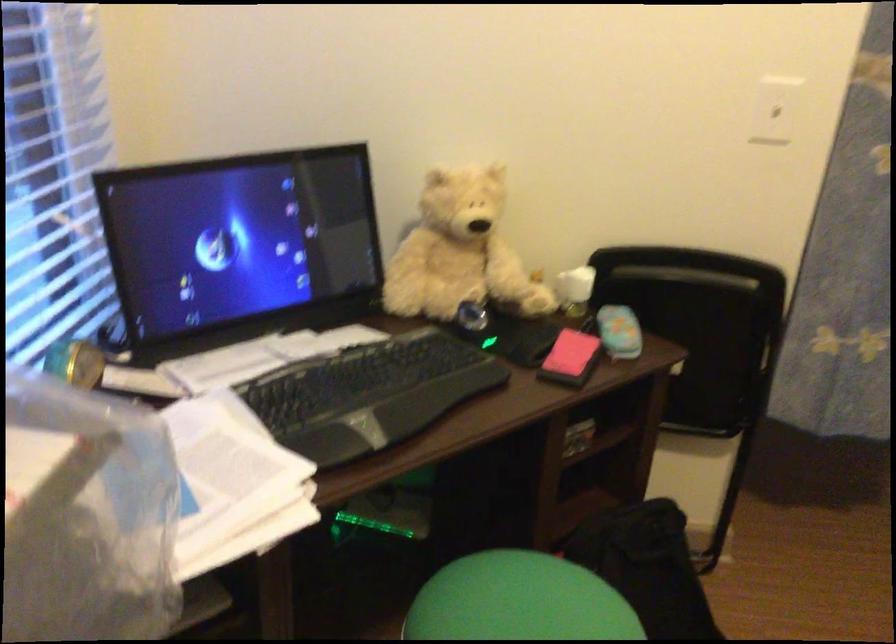
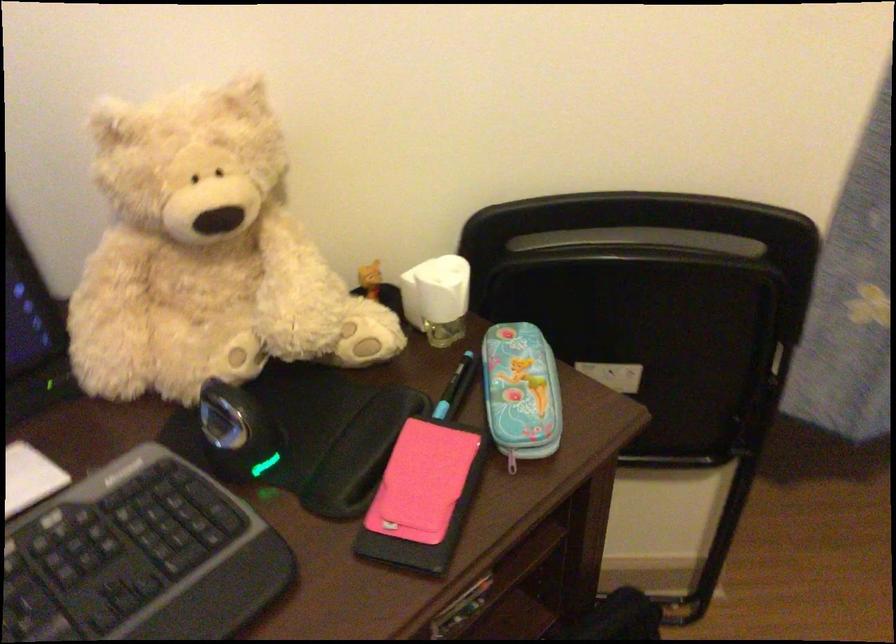
Question: The first image is from the beginning of the video and the second image is from the end. How did the camera likely rotate when shooting the video?

Choices:
 (A) Left
 (B) Right
 (C) Up
 (D) Down

Answer: (D)